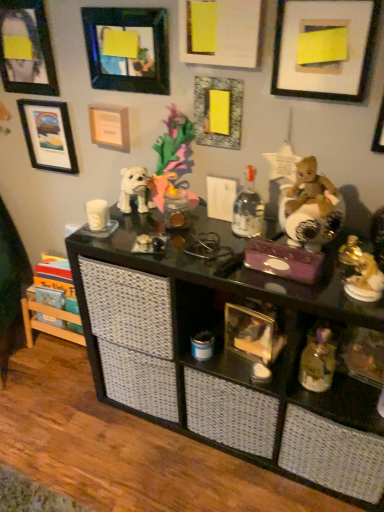
Question: Choose the correct answer: Is matte white frame at upper right, placed as the seventh picture frame when sorted from left to right, inside clear glass bottle at center or outside it?

Choices:
 (A) inside
 (B) outside

Answer: (B)

Question: Considering their positions, is matte white frame at upper right, placed as the seventh picture frame when sorted from left to right, located in front of or behind clear glass bottle at center?

Choices:
 (A) behind
 (B) front

Answer: (B)

Question: Considering the real-world distances, which object is farthest from the black glass shelf at center?

Choices:
 (A) matte yellow paper at center, the 3th picture frame positioned from the right
 (B) shiny gold bear at right, positioned as the first toy in top-to-bottom order
 (C) matte black picture frame at upper left, which is counted as the seventh picture frame, starting from the right
 (D) matte white picture frame at upper left, arranged as the 6th picture frame when viewed from the right
 (E) matte black picture frame at upper center, acting as the fourth picture frame starting from the left

Answer: (C)

Question: Considering the real-world distances, which object is closest to the white matte picture frame at upper center, which is the fifth picture frame in left-to-right order?

Choices:
 (A) matte white picture frame at upper left, arranged as the 6th picture frame when viewed from the right
 (B) matte black picture frame at upper center, acting as the fourth picture frame starting from the left
 (C) matte black picture frame at upper left, acting as the 2th picture frame starting from the left
 (D) shiny gold bear at right, the fourth toy positioned from the bottom
 (E) clear glass bottle at center

Answer: (B)